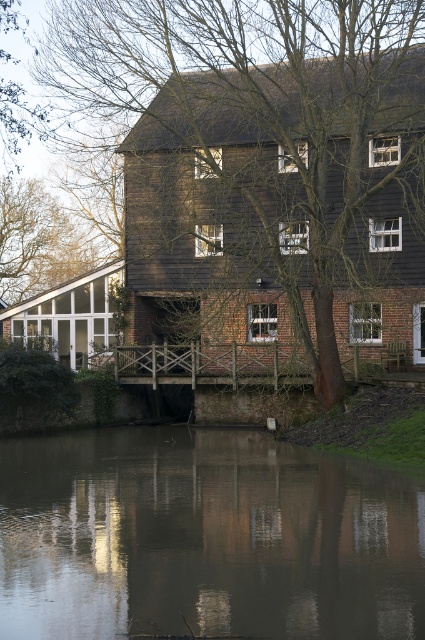
You are standing on the wooden bridge and want to cross to the mill. As you look down, you notice the murky reflective water at center and the brown wood tree at center. Which object is closer to you?

The murky reflective water at center is closer to you because it is in front of the brown wood tree at center.

You are standing at the entrance of the mill and want to cross the wooden bridge to reach the upper floor. However, you notice the murky reflective water at center. Where exactly is the murky reflective water located in relation to your current position?

The murky reflective water at center is located at coordinates point [204,538].

You are a maintenance worker who needs to cross from the mill to the tree on the other side of the water. The wooden bridge is currently under repair and closed. The maintenance robot you have is 1.5 meters wide. Can you use the murky reflective water at center as a path to reach the brown wood tree at center?

The murky reflective water at center and brown wood tree at center are 14.34 meters apart from each other. Since the robot is 1.5 meters wide, the distance between them is sufficient for the robot to travel across the water, but the question of whether the water is safe or solid enough to support the robot isn